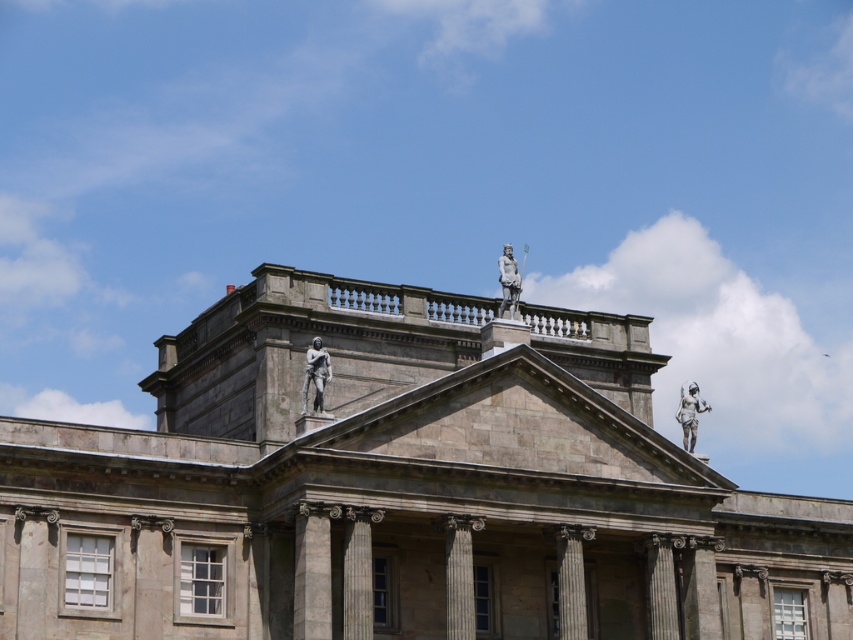
You are an art student analyzing the statues on the building. You notice the gray stone statue at center and the polished bronze statue at upper right. Which statue is shorter?

The gray stone statue at center is not as tall as the polished bronze statue at upper right, so the gray stone statue at center is shorter.